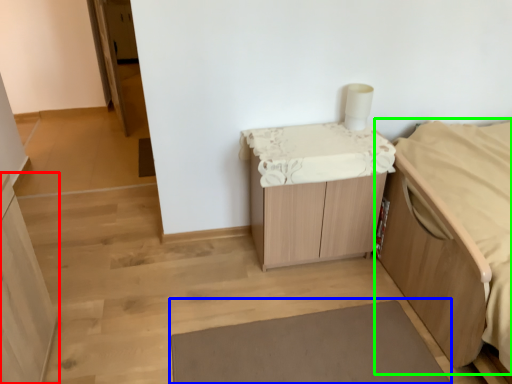
Question: Estimate the real-world distances between objects in this image. Which object is closer to cabinetry (highlighted by a red box), bath mat (highlighted by a blue box) or furniture (highlighted by a green box)?

Choices:
 (A) bath mat
 (B) furniture

Answer: (A)